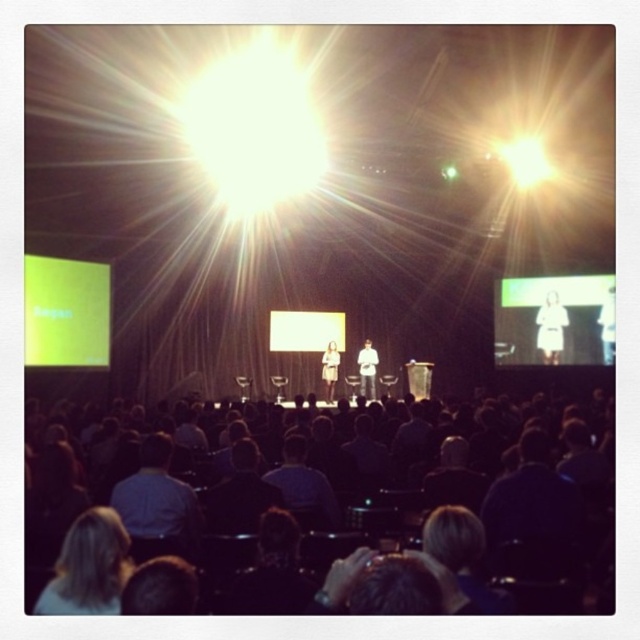
Based on the photo, you are an attendee sitting in the back row of the conference. You notice two people at the center of the stage. Which one is closer to you, the dark blue shirt at center or the white fabric dress at center?

The dark blue shirt at center is closer to you because it is in front of the white fabric dress at center.